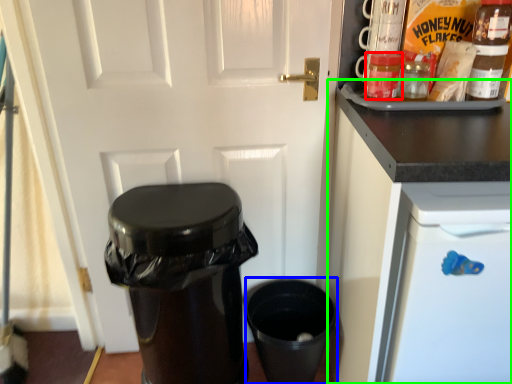
Question: Which is nearer to the bottle (highlighted by a red box)? appliance (highlighted by a blue box) or cabinetry (highlighted by a green box).

Choices:
 (A) appliance
 (B) cabinetry

Answer: (B)